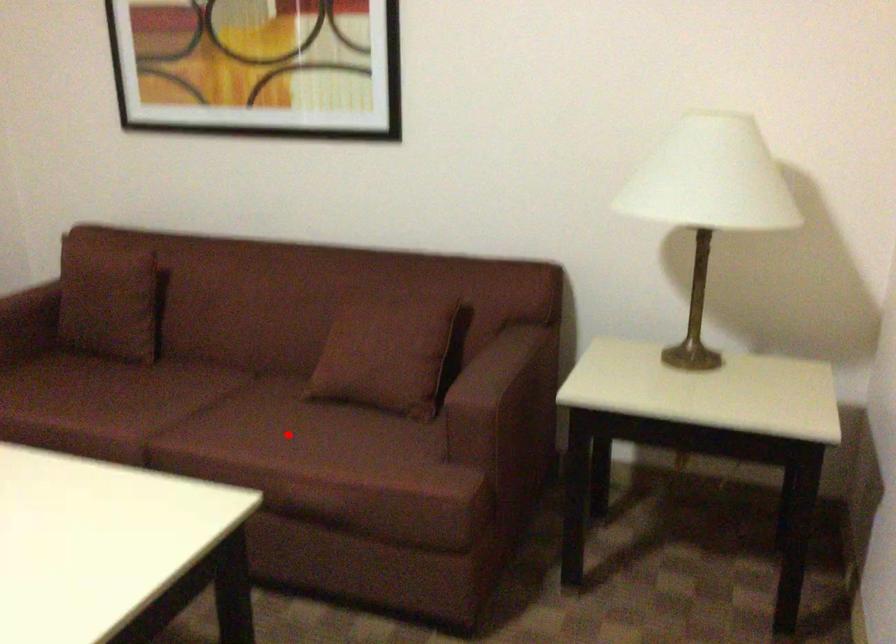
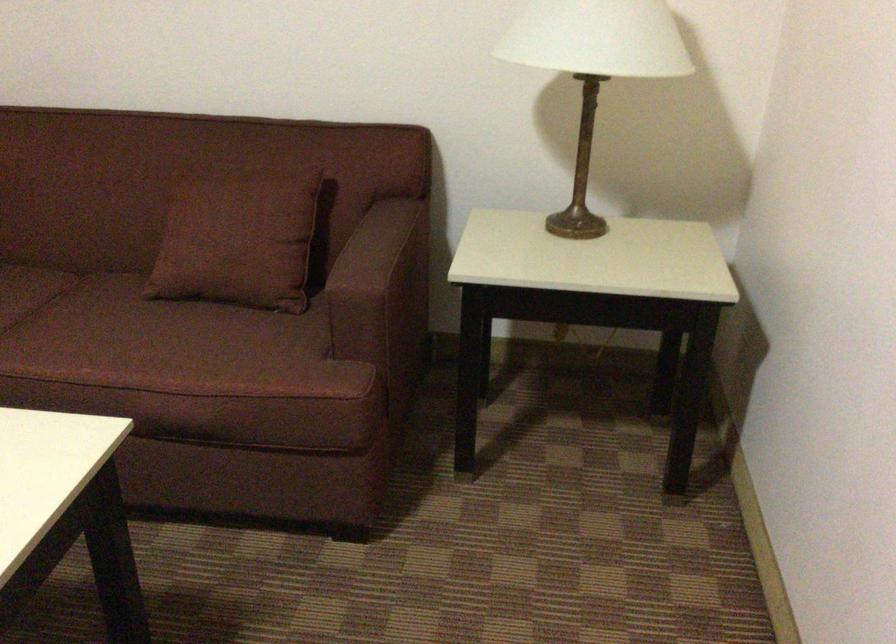
In the second image, find the point that corresponds to the highlighted location in the first image.

(135, 339)